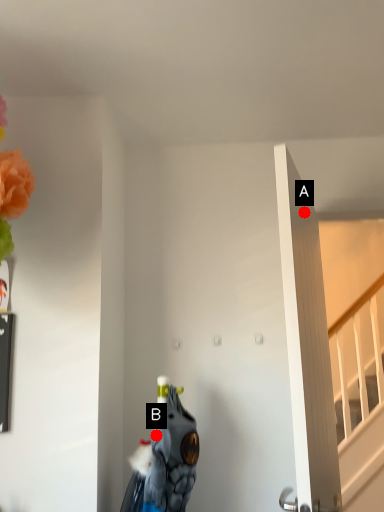
Question: Two points are circled on the image, labeled by A and B beside each circle. Which point is closer to the camera?

Choices:
 (A) A is closer
 (B) B is closer

Answer: (A)